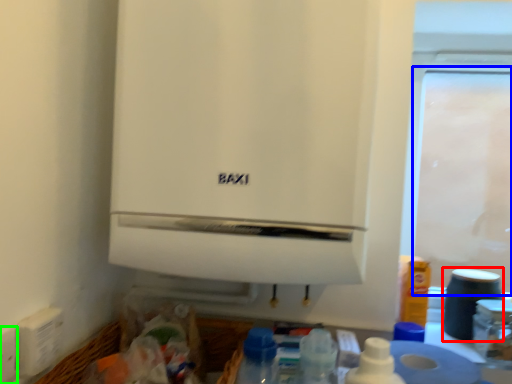
Question: Which object is positioned farthest from appliance (highlighted by a red box)? Select from screen door (highlighted by a blue box) and electric outlet (highlighted by a green box).

Choices:
 (A) screen door
 (B) electric outlet

Answer: (A)